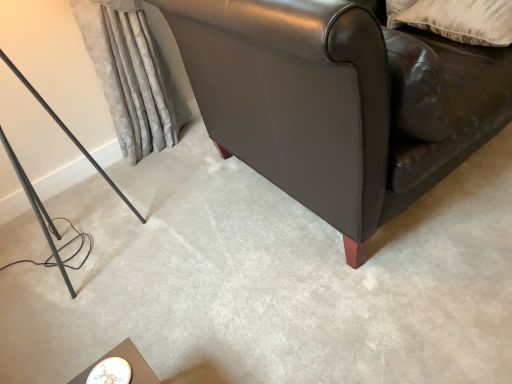
Question: From the image's perspective, is beige textured pillow at upper right positioned above or below silky gray curtain at left?

Choices:
 (A) below
 (B) above

Answer: (B)

Question: Considering the relative positions of beige textured pillow at upper right and silky gray curtain at left in the image provided, is beige textured pillow at upper right to the left or to the right of silky gray curtain at left?

Choices:
 (A) left
 (B) right

Answer: (B)

Question: Which object is positioned farthest from the silky gray curtain at left?

Choices:
 (A) marble top table at lower left
 (B) leather couch at lower right
 (C) matte black leather couch at upper right
 (D) beige textured pillow at upper right

Answer: (A)

Question: Which of these objects is positioned farthest from the leather couch at lower right?

Choices:
 (A) matte black leather couch at upper right
 (B) marble top table at lower left
 (C) beige textured pillow at upper right
 (D) silky gray curtain at left

Answer: (B)